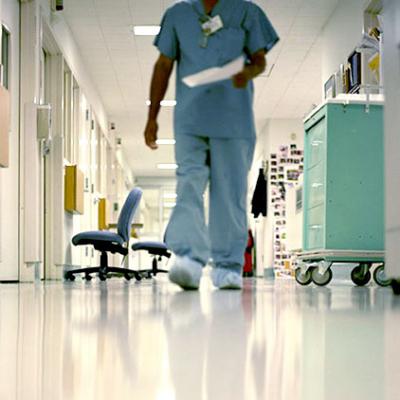
Locate an element on the screen. medical facility floor is located at coordinates (170, 305), (58, 303), (62, 379), (189, 372), (296, 307), (360, 367).